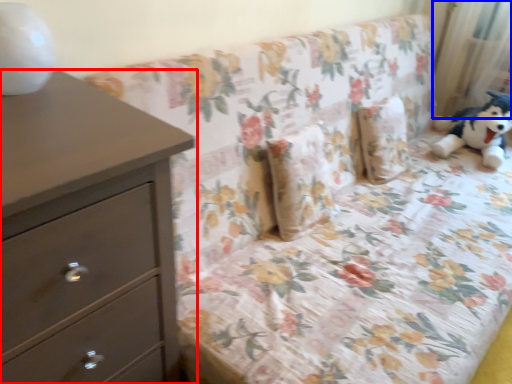
Question: Which object is further to the camera taking this photo, chest of drawers (highlighted by a red box) or curtain (highlighted by a blue box)?

Choices:
 (A) chest of drawers
 (B) curtain

Answer: (B)